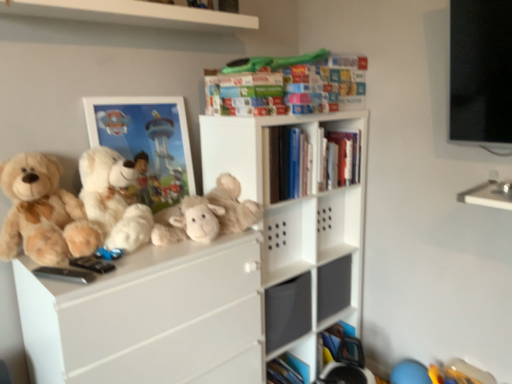
What is the approximate height of multicolored cardboard book at upper center, which is counted as the 1th book, starting from the top?

The height of multicolored cardboard book at upper center, which is counted as the 1th book, starting from the top, is 10.03 inches.

Describe the element at coordinates (288, 85) in the screenshot. Image resolution: width=512 pixels, height=384 pixels. I see `multicolored cardboard book at upper center, which appears as the second book when ordered from the bottom` at that location.

Describe the element at coordinates (208, 215) in the screenshot. I see `fluffy beige stuffed animal at center` at that location.

Measure the distance between fluffy beige stuffed animal at center and camera.

fluffy beige stuffed animal at center is 5.11 feet from camera.

What do you see at coordinates (146, 144) in the screenshot? The height and width of the screenshot is (384, 512). I see `matte plastic picture frame at upper left` at bounding box center [146, 144].

What is the approximate height of matte plastic picture frame at upper left?

matte plastic picture frame at upper left is 20.80 inches tall.

Locate an element on the screen. The image size is (512, 384). multicolored cardboard book at upper center, which appears as the second book when ordered from the bottom is located at coordinates (288, 85).

From the image's perspective, is matte plastic picture frame at upper left above or below hardcover books at center, acting as the second book starting from the top?

Based on their image positions, matte plastic picture frame at upper left is located beneath hardcover books at center, acting as the second book starting from the top.

From a real-world perspective, is matte plastic picture frame at upper left below hardcover books at center, acting as the second book starting from the top?

No, from a real-world perspective, matte plastic picture frame at upper left is not below hardcover books at center, acting as the second book starting from the top.

Can you see matte plastic picture frame at upper left touching hardcover books at center, which is the 1th book from bottom to top?

No, matte plastic picture frame at upper left is not next to hardcover books at center, which is the 1th book from bottom to top.

Does matte plastic picture frame at upper left have a smaller size compared to hardcover books at center, which is the 1th book from bottom to top?

Indeed, matte plastic picture frame at upper left has a smaller size compared to hardcover books at center, which is the 1th book from bottom to top.

Considering the positions of objects hardcover books at center, acting as the second book starting from the top, and fluffy beige stuffed animal at center in the image provided, who is more to the left, hardcover books at center, acting as the second book starting from the top, or fluffy beige stuffed animal at center?

fluffy beige stuffed animal at center.

Would you consider hardcover books at center, which is the 1th book from bottom to top, to be distant from fluffy beige stuffed animal at center?

No.

Which point is more forward, [300,142] or [173,219]?

Positioned in front is point [173,219].

Looking at their sizes, would you say hardcover books at center, which is the 1th book from bottom to top, is wider or thinner than fluffy beige stuffed animal at center?

hardcover books at center, which is the 1th book from bottom to top, is thinner than fluffy beige stuffed animal at center.

How many degrees apart are the facing directions of white plush teddy bear at left, the 2th teddy bear viewed from the left, and multicolored cardboard book at upper center, which appears as the second book when ordered from the bottom?

The angle between the facing direction of white plush teddy bear at left, the 2th teddy bear viewed from the left, and the facing direction of multicolored cardboard book at upper center, which appears as the second book when ordered from the bottom, is 0.515 degrees.

Is white plush teddy bear at left, which is counted as the 1th teddy bear, starting from the right, touching multicolored cardboard book at upper center, which appears as the second book when ordered from the bottom?

They are not placed beside each other.

Who is more distant, white plush teddy bear at left, the 2th teddy bear viewed from the left, or multicolored cardboard book at upper center, which appears as the second book when ordered from the bottom?

multicolored cardboard book at upper center, which appears as the second book when ordered from the bottom, is further from the camera.

Is white plush teddy bear at left, the 2th teddy bear viewed from the left, oriented away from multicolored cardboard book at upper center, which is counted as the 1th book, starting from the top?

No.

From the image's perspective, is hardcover books at center, which is the 1th book from bottom to top, positioned above or below soft beige teddy bear at left, which is the first teddy bear from left to right?

Clearly, from the image's perspective, hardcover books at center, which is the 1th book from bottom to top, is above soft beige teddy bear at left, which is the first teddy bear from left to right.

Considering the relative sizes of hardcover books at center, acting as the second book starting from the top, and soft beige teddy bear at left, which is the first teddy bear from left to right, in the image provided, is hardcover books at center, acting as the second book starting from the top, shorter than soft beige teddy bear at left, which is the first teddy bear from left to right,?

Indeed, hardcover books at center, acting as the second book starting from the top, has a lesser height compared to soft beige teddy bear at left, which is the first teddy bear from left to right.

Choose the correct answer: Is hardcover books at center, which is the 1th book from bottom to top, inside soft beige teddy bear at left, which ranks as the 2th teddy bear in right-to-left order, or outside it?

hardcover books at center, which is the 1th book from bottom to top, is not enclosed by soft beige teddy bear at left, which ranks as the 2th teddy bear in right-to-left order.

Considering the relative sizes of white plush teddy bear at left, the 2th teddy bear viewed from the left, and soft beige teddy bear at left, which is the first teddy bear from left to right, in the image provided, is white plush teddy bear at left, the 2th teddy bear viewed from the left, thinner than soft beige teddy bear at left, which is the first teddy bear from left to right,?

In fact, white plush teddy bear at left, the 2th teddy bear viewed from the left, might be wider than soft beige teddy bear at left, which is the first teddy bear from left to right.

Considering the sizes of white plush teddy bear at left, which is counted as the 1th teddy bear, starting from the right, and soft beige teddy bear at left, which ranks as the 2th teddy bear in right-to-left order, in the image, is white plush teddy bear at left, which is counted as the 1th teddy bear, starting from the right, bigger or smaller than soft beige teddy bear at left, which ranks as the 2th teddy bear in right-to-left order,?

Considering their sizes, white plush teddy bear at left, which is counted as the 1th teddy bear, starting from the right, takes up more space than soft beige teddy bear at left, which ranks as the 2th teddy bear in right-to-left order.

Which object is further away from the camera taking this photo, white plush teddy bear at left, which is counted as the 1th teddy bear, starting from the right, or soft beige teddy bear at left, which ranks as the 2th teddy bear in right-to-left order?

Positioned behind is white plush teddy bear at left, which is counted as the 1th teddy bear, starting from the right.

Who is smaller, hardcover books at center, which is the 1th book from bottom to top, or matte plastic picture frame at upper left?

With smaller size is matte plastic picture frame at upper left.

Between hardcover books at center, which is the 1th book from bottom to top, and matte plastic picture frame at upper left, which one appears on the right side from the viewer's perspective?

From the viewer's perspective, hardcover books at center, which is the 1th book from bottom to top, appears more on the right side.

Is hardcover books at center, which is the 1th book from bottom to top, looking in the opposite direction of matte plastic picture frame at upper left?

No.

Considering the positions of objects hardcover books at center, acting as the second book starting from the top, and matte plastic picture frame at upper left in the image provided, who is behind, hardcover books at center, acting as the second book starting from the top, or matte plastic picture frame at upper left?

hardcover books at center, acting as the second book starting from the top.

Is white plush teddy bear at left, the 2th teddy bear viewed from the left, positioned far away from fluffy beige stuffed animal at center?

That's not correct — white plush teddy bear at left, the 2th teddy bear viewed from the left, is a little close to fluffy beige stuffed animal at center.

Is white plush teddy bear at left, the 2th teddy bear viewed from the left, at the left side of fluffy beige stuffed animal at center?

Yes, white plush teddy bear at left, the 2th teddy bear viewed from the left, is to the left of fluffy beige stuffed animal at center.

In the image, is white plush teddy bear at left, which is counted as the 1th teddy bear, starting from the right, positioned in front of or behind fluffy beige stuffed animal at center?

Clearly, white plush teddy bear at left, which is counted as the 1th teddy bear, starting from the right, is in front of fluffy beige stuffed animal at center.

Can you tell me how much white plush teddy bear at left, the 2th teddy bear viewed from the left, and fluffy beige stuffed animal at center differ in facing direction?

The angular difference between white plush teddy bear at left, the 2th teddy bear viewed from the left, and fluffy beige stuffed animal at center is 0.893 degrees.

You are a GUI agent. You are given a task and a screenshot of the screen. Output one action in this format:
    pyautogui.click(x=<x>, y=<y>)
    Task: Click on the picture frame positioned vertically above the hardcover books at center, which is the 1th book from bottom to top (from a real-world perspective)
    
    Given the screenshot: What is the action you would take?
    pyautogui.click(x=146, y=144)

The image size is (512, 384). In order to click on toy that appears below the hardcover books at center, which is the 1th book from bottom to top (from a real-world perspective) in this screenshot , I will do `click(208, 215)`.

Considering their positions, is white plush teddy bear at left, which is counted as the 1th teddy bear, starting from the right, positioned further to multicolored cardboard book at upper center, which appears as the second book when ordered from the bottom, than fluffy beige stuffed animal at center?

Among the two, white plush teddy bear at left, which is counted as the 1th teddy bear, starting from the right, is located further to multicolored cardboard book at upper center, which appears as the second book when ordered from the bottom.

Considering their positions, is multicolored cardboard book at upper center, which appears as the second book when ordered from the bottom, positioned further to soft beige teddy bear at left, which is the first teddy bear from left to right, than fluffy beige stuffed animal at center?

multicolored cardboard book at upper center, which appears as the second book when ordered from the bottom, lies further to soft beige teddy bear at left, which is the first teddy bear from left to right, than the other object.

From the image, which object appears to be farther from multicolored cardboard book at upper center, which is counted as the 1th book, starting from the top, white plush teddy bear at left, the 2th teddy bear viewed from the left, or matte plastic picture frame at upper left?

white plush teddy bear at left, the 2th teddy bear viewed from the left, is further to multicolored cardboard book at upper center, which is counted as the 1th book, starting from the top.

Based on their spatial positions, is white plush teddy bear at left, the 2th teddy bear viewed from the left, or hardcover books at center, which is the 1th book from bottom to top, further from soft beige teddy bear at left, which is the first teddy bear from left to right?

hardcover books at center, which is the 1th book from bottom to top.

Considering their positions, is hardcover books at center, which is the 1th book from bottom to top, positioned closer to fluffy beige stuffed animal at center than multicolored cardboard book at upper center, which is counted as the 1th book, starting from the top?

hardcover books at center, which is the 1th book from bottom to top, lies closer to fluffy beige stuffed animal at center than the other object.

From the image, which object appears to be nearer to white plush teddy bear at left, the 2th teddy bear viewed from the left, multicolored cardboard book at upper center, which appears as the second book when ordered from the bottom, or fluffy beige stuffed animal at center?

fluffy beige stuffed animal at center lies closer to white plush teddy bear at left, the 2th teddy bear viewed from the left, than the other object.

From the image, which object appears to be nearer to hardcover books at center, which is the 1th book from bottom to top, soft beige teddy bear at left, which is the first teddy bear from left to right, or white plush teddy bear at left, which is counted as the 1th teddy bear, starting from the right?

white plush teddy bear at left, which is counted as the 1th teddy bear, starting from the right, is closer to hardcover books at center, which is the 1th book from bottom to top.

From the image, which object appears to be farther from soft beige teddy bear at left, which ranks as the 2th teddy bear in right-to-left order, white plush teddy bear at left, which is counted as the 1th teddy bear, starting from the right, or matte plastic picture frame at upper left?

matte plastic picture frame at upper left is positioned further to the anchor soft beige teddy bear at left, which ranks as the 2th teddy bear in right-to-left order.

Locate an element on the screen. This screenshot has height=384, width=512. book between matte plastic picture frame at upper left and hardcover books at center, acting as the second book starting from the top is located at coordinates (288, 85).

You are a GUI agent. You are given a task and a screenshot of the screen. Output one action in this format:
    pyautogui.click(x=<x>, y=<y>)
    Task: Click on the toy situated between white plush teddy bear at left, the 2th teddy bear viewed from the left, and hardcover books at center, acting as the second book starting from the top, from left to right
    
    Given the screenshot: What is the action you would take?
    pyautogui.click(x=208, y=215)

Where is `teddy bear positioned between soft beige teddy bear at left, which ranks as the 2th teddy bear in right-to-left order, and matte plastic picture frame at upper left from near to far`? The image size is (512, 384). teddy bear positioned between soft beige teddy bear at left, which ranks as the 2th teddy bear in right-to-left order, and matte plastic picture frame at upper left from near to far is located at coordinates (113, 199).

Where is `book between fluffy beige stuffed animal at center and hardcover books at center, which is the 1th book from bottom to top, from left to right`? book between fluffy beige stuffed animal at center and hardcover books at center, which is the 1th book from bottom to top, from left to right is located at coordinates (288, 85).